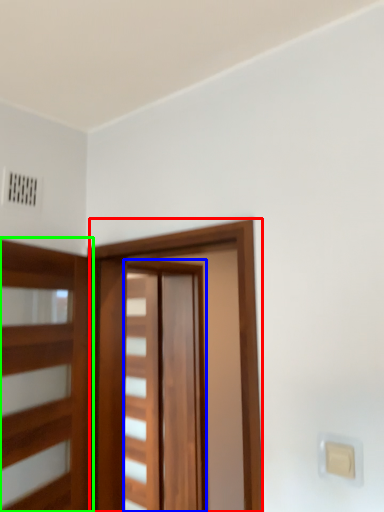
Question: Which object is positioned farthest from barn door (highlighted by a red box)? Select from barn door (highlighted by a blue box) and elevator (highlighted by a green box).

Choices:
 (A) barn door
 (B) elevator

Answer: (A)